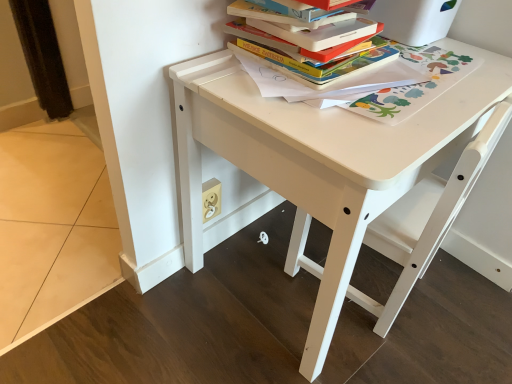
Identify the location of free spot in front of hardcover books at upper center. The width and height of the screenshot is (512, 384). (344, 117).